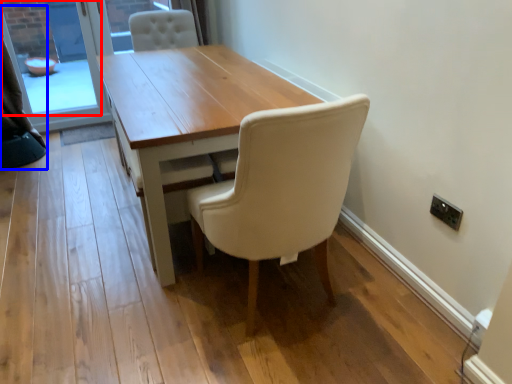
Question: Which object is closer to the camera taking this photo, window screen (highlighted by a red box) or curtain (highlighted by a blue box)?

Choices:
 (A) window screen
 (B) curtain

Answer: (B)